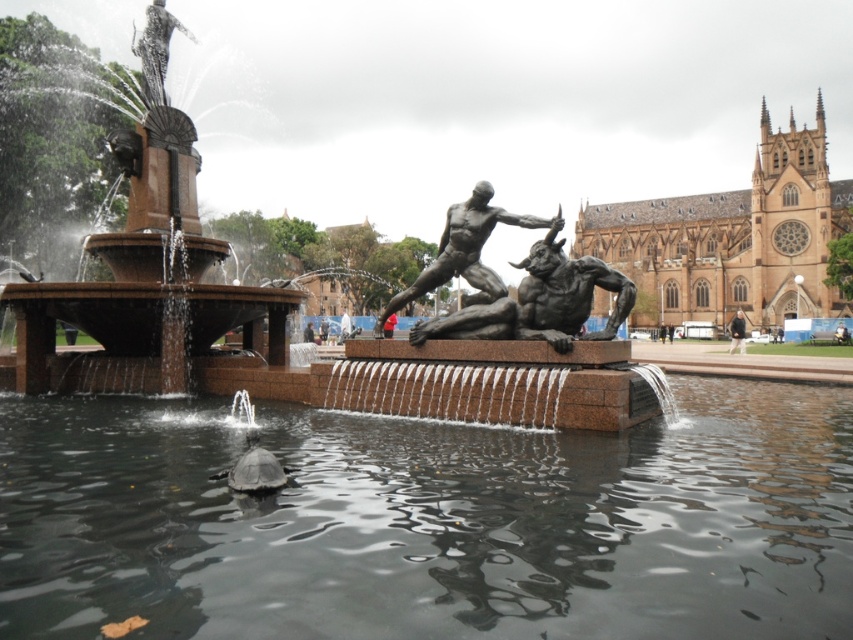
You are standing in the public square and see the bronze statue at center and the shiny black turtle at lower center. Which object is positioned to the left of the other?

The bronze statue at center is to the left of shiny black turtle at lower center.

You are standing in the public square and want to take a photo of the bronze statue at center and the shiny black turtle at lower center. To ensure both are in the frame, should you adjust your camera angle upwards or downwards?

The bronze statue at center is located above the shiny black turtle at lower center, so you should adjust your camera angle downwards to capture both in the frame.